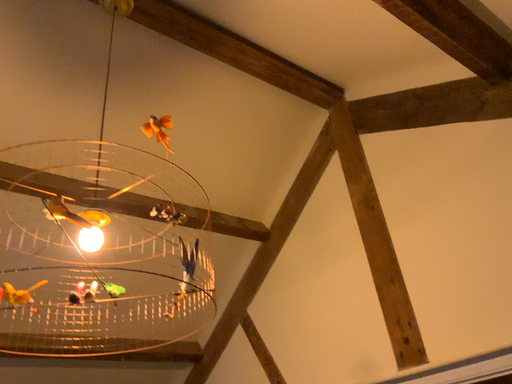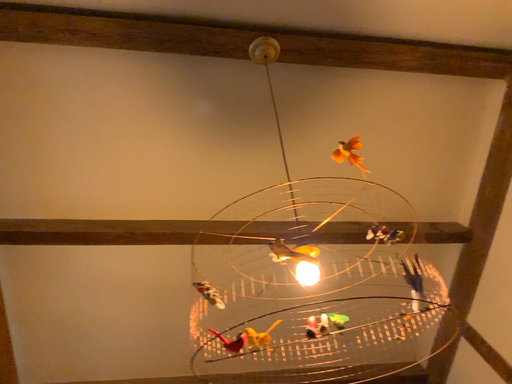
Question: Which way did the camera rotate in the video?

Choices:
 (A) rotated right
 (B) rotated left

Answer: (B)